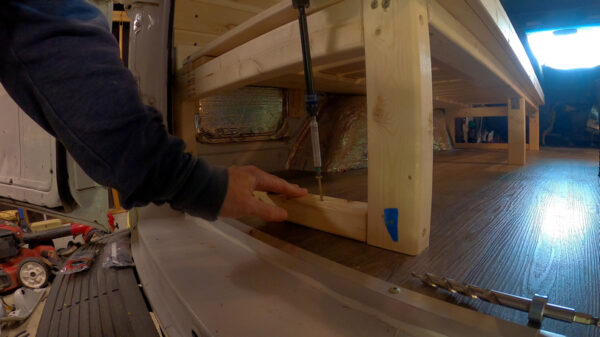
Locate an element on the screen. Image resolution: width=600 pixels, height=337 pixels. window is located at coordinates (267, 115).